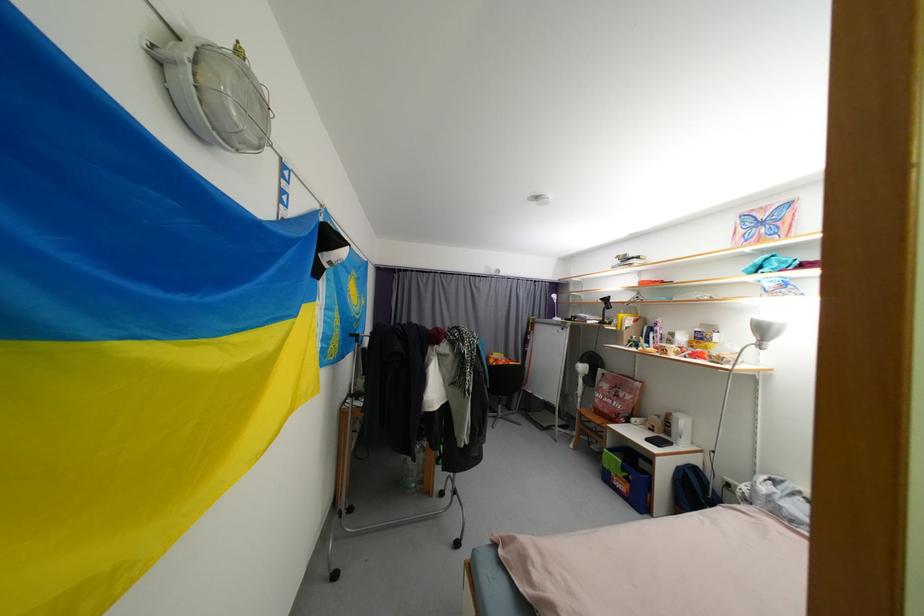
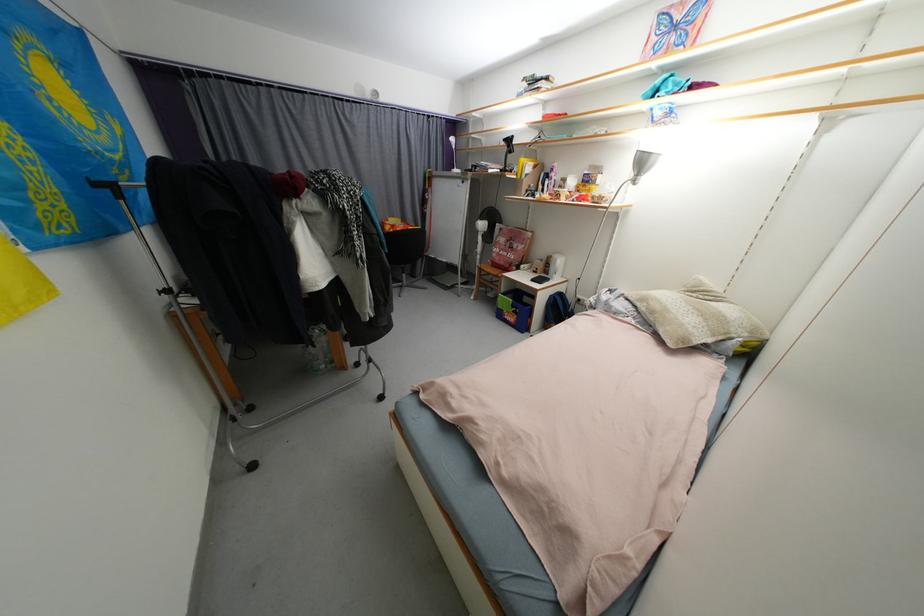
Where in the second image is the point corresponding to point (769, 331) from the first image?

(648, 164)